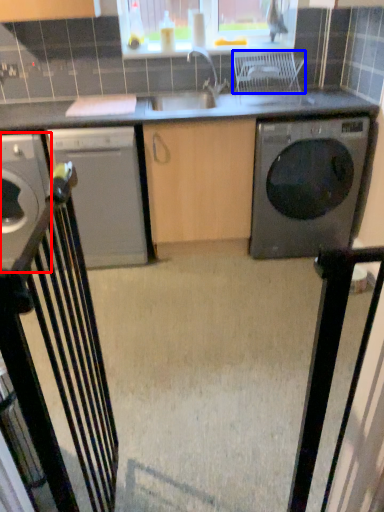
Question: Which object appears farthest to the camera in this image, home appliance (highlighted by a red box) or chair (highlighted by a blue box)?

Choices:
 (A) home appliance
 (B) chair

Answer: (A)